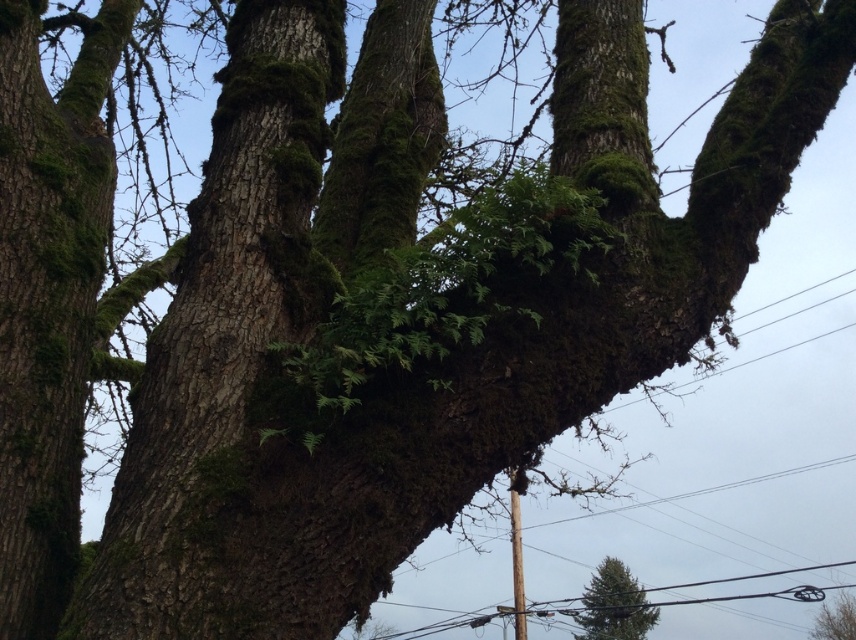
Question: Is green mossy bark at center to the right of green mossy tree at center from the viewer's perspective?

Choices:
 (A) no
 (B) yes

Answer: (A)

Question: Which of the following is the farthest from the observer?

Choices:
 (A) brown wooden telegraph pole at center
 (B) green mossy tree trunk at left

Answer: (A)

Question: Can you confirm if green mossy bark at center is positioned above brown wooden pole at lower center?

Choices:
 (A) no
 (B) yes

Answer: (B)

Question: Among these points, which one is farthest from the camera?

Choices:
 (A) (468, 620)
 (B) (525, 628)
 (C) (837, 614)
 (D) (262, 305)

Answer: (C)

Question: Which object is positioned closest to the brown wooden telegraph pole at center?

Choices:
 (A) green mossy tree trunk at left
 (B) green mossy tree at center
 (C) brown wooden pole at lower center
 (D) green mossy bark at center

Answer: (D)

Question: Is green textured pine tree at lower right further to the viewer compared to brown wooden telegraph pole at center?

Choices:
 (A) no
 (B) yes

Answer: (B)